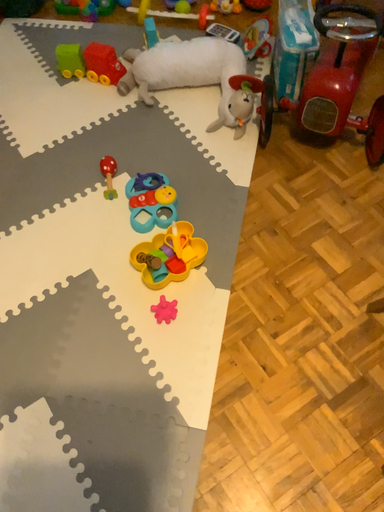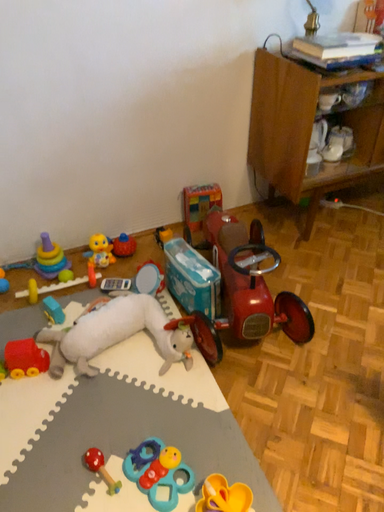
Question: How did the camera likely rotate when shooting the video?

Choices:
 (A) rotated upward
 (B) rotated downward

Answer: (A)